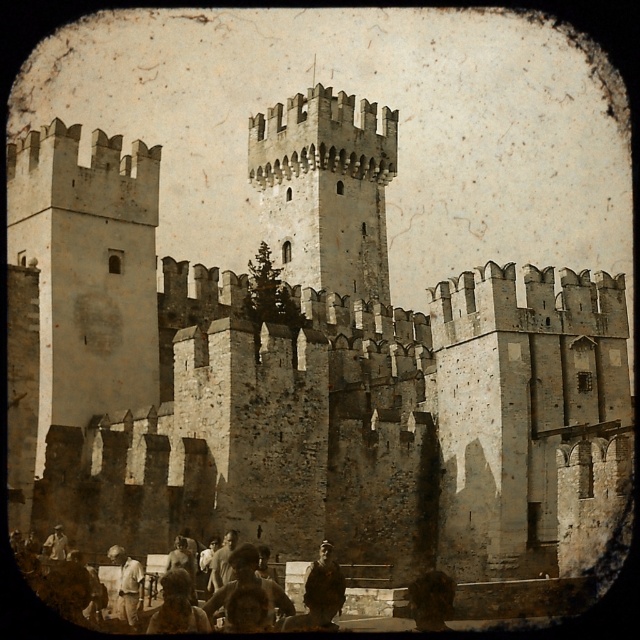
Question: Is brown textured hair at lower center to the left of light brown leather jacket at lower center from the viewer's perspective?

Choices:
 (A) yes
 (B) no

Answer: (B)

Question: Does dark brown leather jacket at center come behind brown textured hair at lower center?

Choices:
 (A) no
 (B) yes

Answer: (A)

Question: Observing the image, what is the correct spatial positioning of stone textured tower at center in reference to light brown leather jacket at lower center?

Choices:
 (A) above
 (B) below

Answer: (A)

Question: Which of these objects is positioned closest to the brown textured hair at lower center?

Choices:
 (A) light brown leather jacket at lower center
 (B) dark brown leather jacket at center

Answer: (B)

Question: Which object is positioned farthest from the light brown leather jacket at lower left?

Choices:
 (A) light brown leather jacket at lower center
 (B) dark brown leather jacket at center
 (C) brown textured hair at lower center

Answer: (B)

Question: Considering the real-world distances, which object is farthest from the light brown leather jacket at lower center?

Choices:
 (A) stone textured tower at center
 (B) brown textured hair at lower center
 (C) light brown leather jacket at lower left
 (D) dark brown leather jacket at center

Answer: (A)